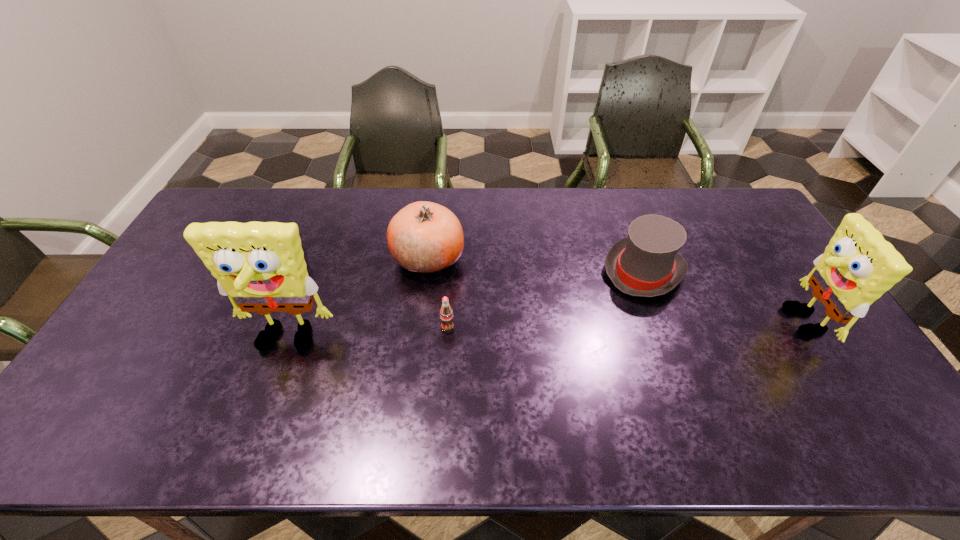
The height and width of the screenshot is (540, 960). Find the location of `free spot located on the face of the fifth shortest object`. free spot located on the face of the fifth shortest object is located at coordinates (741, 321).

Where is `vacant space located on the face of the fifth shortest object`? vacant space located on the face of the fifth shortest object is located at coordinates (670, 321).

The width and height of the screenshot is (960, 540). I want to click on blank area located 0.230m on the face of the fifth shortest object, so click(699, 321).

Locate an element on the screen. The width and height of the screenshot is (960, 540). vacant space located 0.230m on the front of the fourth shortest object is located at coordinates (418, 345).

Identify the location of blank space located 0.050m on the left of the dress hat. (587, 271).

Find the location of a particular element. The image size is (960, 540). free space located on the back of the second shortest object is located at coordinates (452, 251).

Locate an element on the screen. The image size is (960, 540). vacant region located 0.270m on the front of the shortest object is located at coordinates (239, 353).

Identify the location of object located in the right edge section of the desktop. The width and height of the screenshot is (960, 540). (858, 266).

In the image, there is a desktop. Where is `vacant area at the far edge`? vacant area at the far edge is located at coordinates (419, 190).

Locate an element on the screen. free space at the near edge is located at coordinates (271, 402).